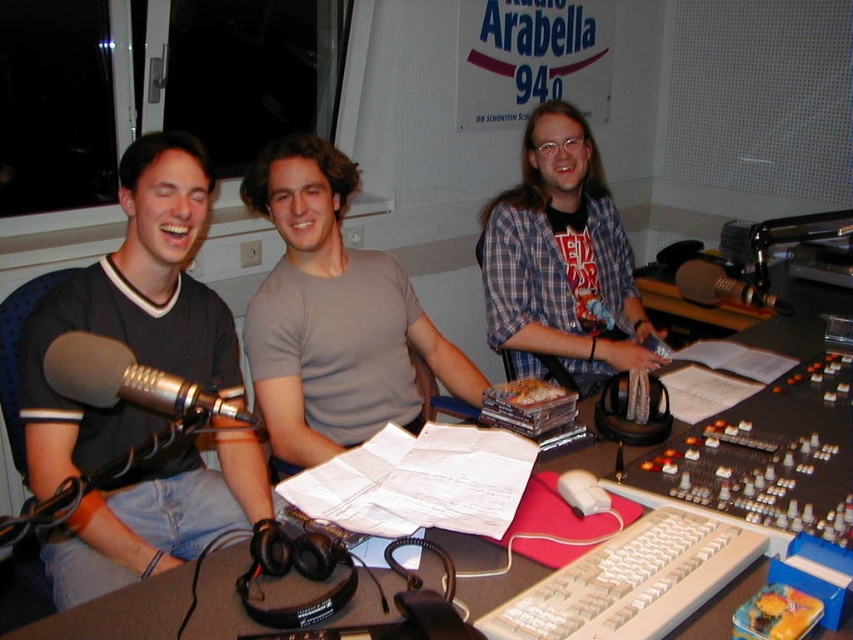
Question: Does gray cotton t-shirt at center appear on the left side of silver metallic microphone at left?

Choices:
 (A) no
 (B) yes

Answer: (A)

Question: Which of these objects is positioned closest to the matte black shirt at left?

Choices:
 (A) plaid shirt at center
 (B) metallic silver microphone at center right
 (C) gray cotton t-shirt at center
 (D) white plastic table at center

Answer: (C)

Question: Which point is closer to the camera?

Choices:
 (A) (404, 346)
 (B) (583, 177)

Answer: (A)

Question: From the image, what is the correct spatial relationship of gray cotton t-shirt at center in relation to white plastic table at center?

Choices:
 (A) above
 (B) below

Answer: (A)

Question: Estimate the real-world distances between objects in this image. Which object is closer to the gray cotton t-shirt at center?

Choices:
 (A) silver metallic microphone at left
 (B) metallic silver microphone at center right

Answer: (B)

Question: Where is plaid shirt at center located in relation to silver metallic microphone at left in the image?

Choices:
 (A) above
 (B) below

Answer: (A)